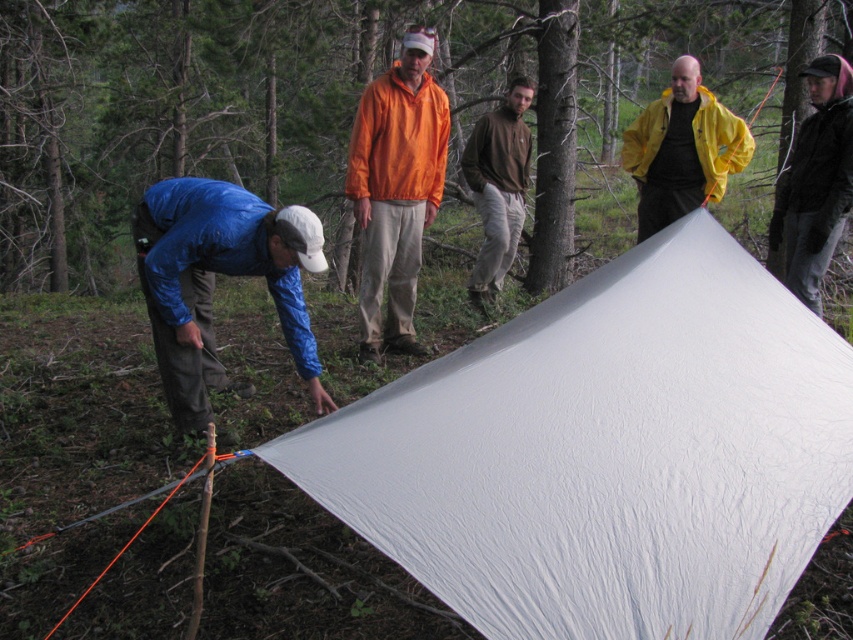
Which is below, black matte jacket at upper right or brown cotton shirt at center?

black matte jacket at upper right is below.

Between black matte jacket at upper right and brown cotton shirt at center, which one has more height?

brown cotton shirt at center

I want to click on black matte jacket at upper right, so click(x=816, y=180).

Between white matte tarp at center and black matte jacket at upper right, which one has more height?

black matte jacket at upper right is taller.

Does white matte tarp at center have a larger size compared to black matte jacket at upper right?

Yes.

Between point (430, 413) and point (798, 208), which one is positioned behind?

The point (798, 208) is behind.

Locate an element on the screen. white matte tarp at center is located at coordinates (606, 452).

Can you confirm if white matte tarp at center is wider than orange nylon jacket at center?

Correct, the width of white matte tarp at center exceeds that of orange nylon jacket at center.

Between white matte tarp at center and orange nylon jacket at center, which one appears on the right side from the viewer's perspective?

Positioned to the right is white matte tarp at center.

Which is behind, point (260, 445) or point (399, 65)?

Point (399, 65)

The image size is (853, 640). Find the location of `white matte tarp at center`. white matte tarp at center is located at coordinates (606, 452).